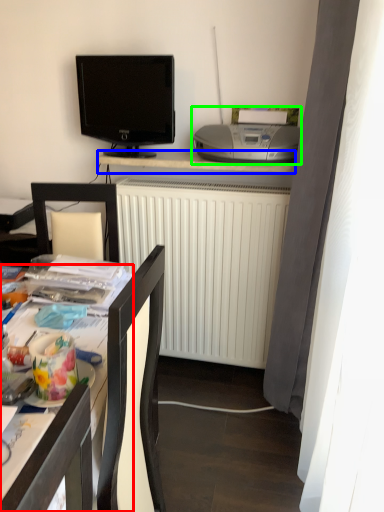
Question: Which is nearer to the desk (highlighted by a red box)? desk (highlighted by a blue box) or printer (highlighted by a green box).

Choices:
 (A) desk
 (B) printer

Answer: (B)